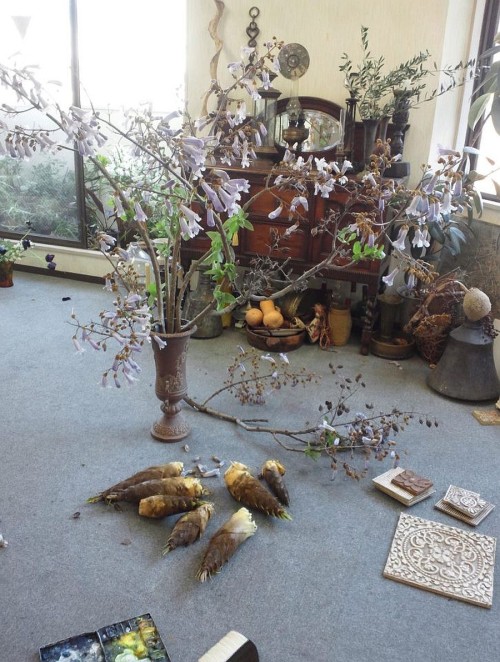
Find the location of a particular element. Image resolution: width=500 pixels, height=662 pixels. 2 books on floor is located at coordinates (114, 643), (226, 649).